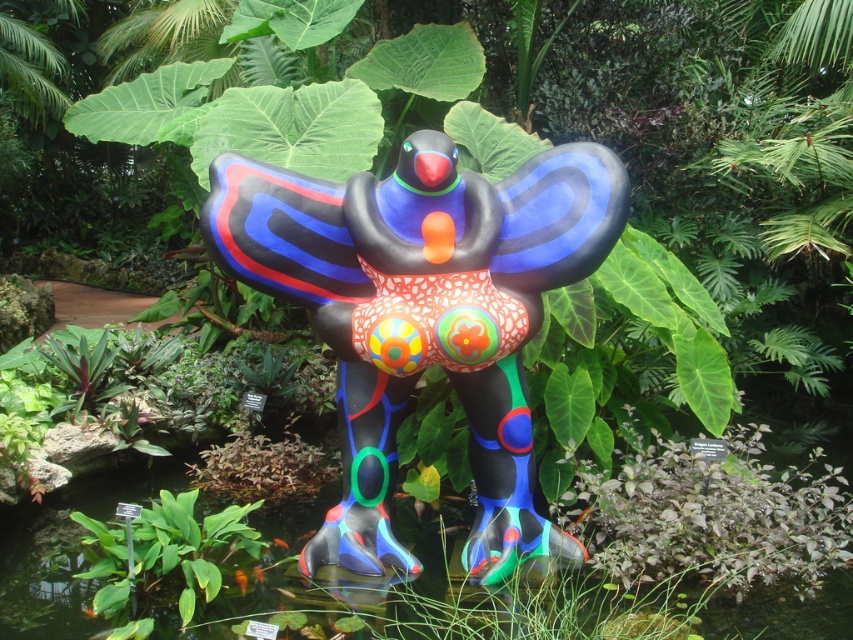
Question: Which object is closer to the camera taking this photo?

Choices:
 (A) glossy plastic bird at center
 (B) green leafy plant at lower center

Answer: (B)

Question: Which of the following is the farthest from the observer?

Choices:
 (A) glossy plastic bird at center
 (B) green leafy plant at lower center

Answer: (A)

Question: Is glossy plastic bird at center closer to the viewer compared to green leafy plant at lower center?

Choices:
 (A) no
 (B) yes

Answer: (A)

Question: Does glossy plastic bird at center appear over green leafy plant at lower center?

Choices:
 (A) yes
 (B) no

Answer: (A)

Question: Is glossy plastic bird at center smaller than green leafy plant at lower center?

Choices:
 (A) yes
 (B) no

Answer: (B)